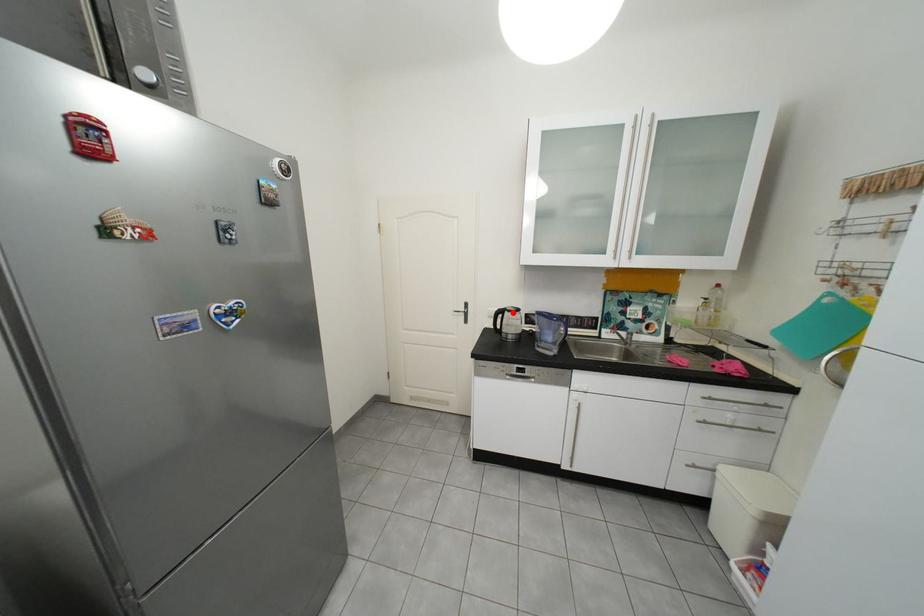
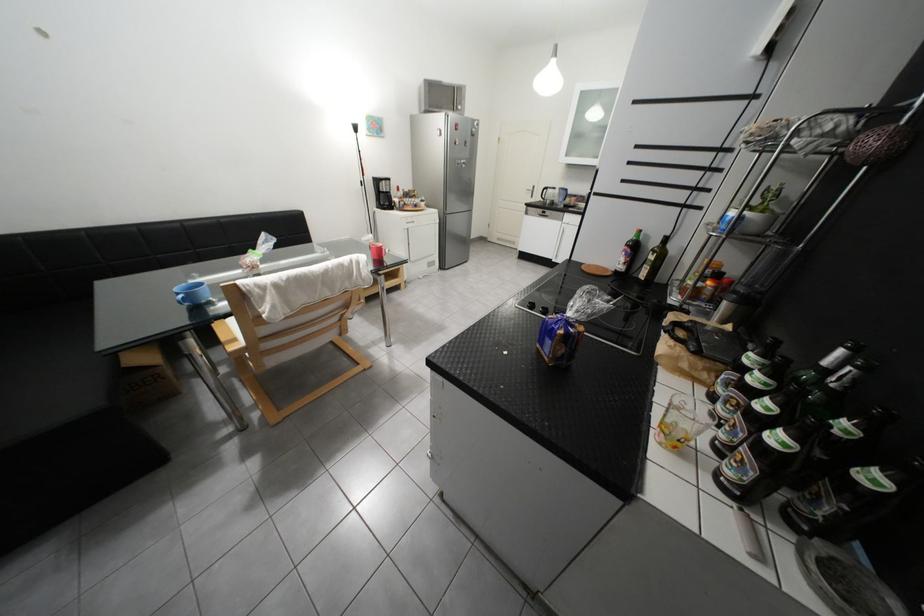
Question: I am providing you with two images of the same scene from different viewpoints. Given a red point in image1, look at the same physical point in image2. Is it:

Choices:
 (A) Closer to the viewpoint
 (B) Farther from the viewpoint

Answer: (A)